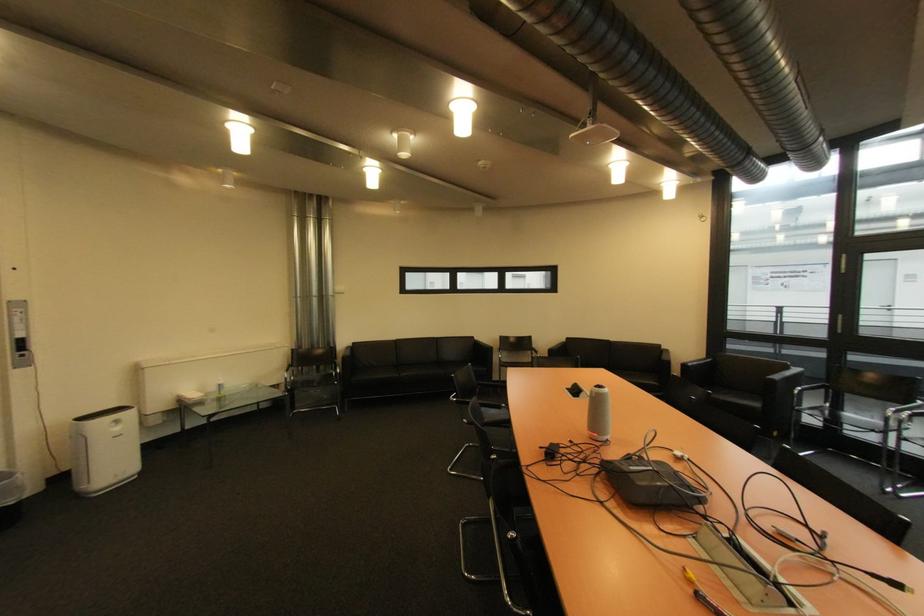
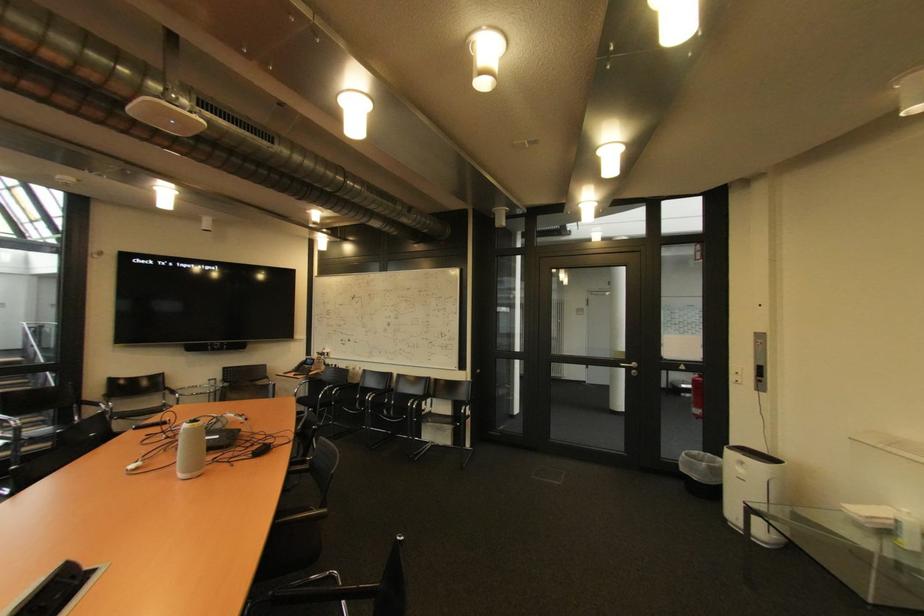
Find the pixel in the second image that matches point (124, 430) in the first image.

(748, 471)